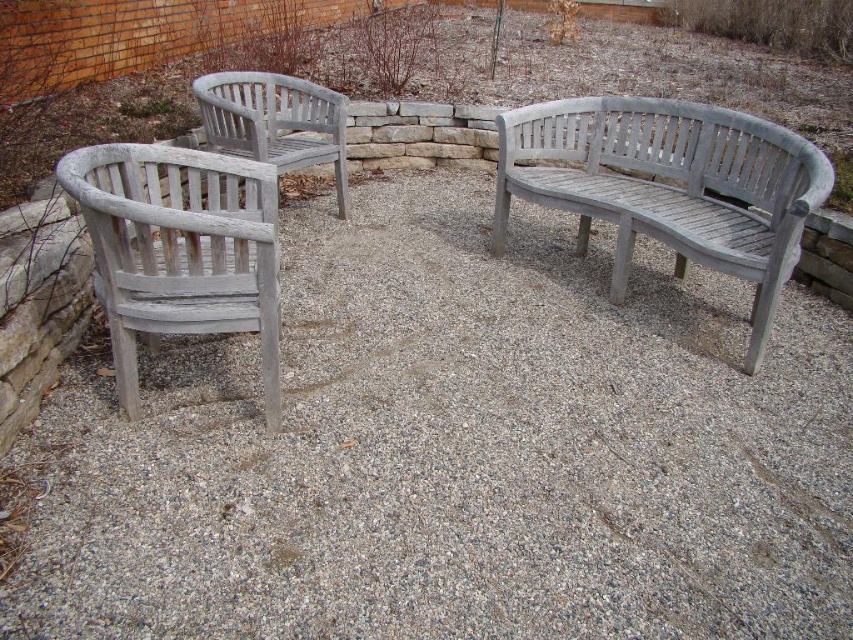
Does white weathered wood chair at left have a smaller size compared to gray wood bench at center?

No.

You are a GUI agent. You are given a task and a screenshot of the screen. Output one action in this format:
    pyautogui.click(x=<x>, y=<y>)
    Task: Click on the white weathered wood chair at left
    
    Given the screenshot: What is the action you would take?
    click(178, 250)

Can you confirm if weathered wood bench at right is positioned to the left of gray wood bench at center?

Incorrect, weathered wood bench at right is not on the left side of gray wood bench at center.

Does weathered wood bench at right come behind gray wood bench at center?

That is False.

Does point (640, 168) come in front of point (252, 125)?

No.

In order to click on weathered wood bench at right in this screenshot , I will do `click(669, 186)`.

Can you confirm if gray gravel at center is wider than weathered wood bench at right?

Correct, the width of gray gravel at center exceeds that of weathered wood bench at right.

Which is behind, point (384, 237) or point (695, 198)?

Positioned behind is point (384, 237).

I want to click on gray gravel at center, so click(x=456, y=451).